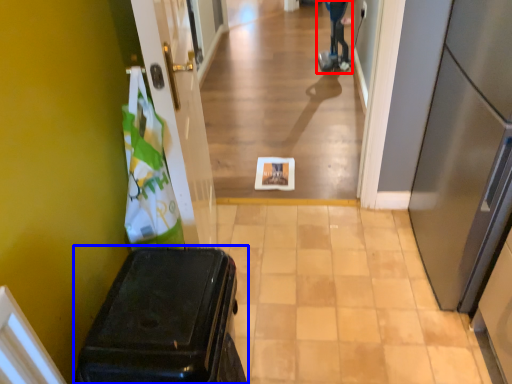
Question: Which point is closer to the camera, mobility scooter (highlighted by a red box) or suitcase (highlighted by a blue box)?

Choices:
 (A) mobility scooter
 (B) suitcase

Answer: (B)